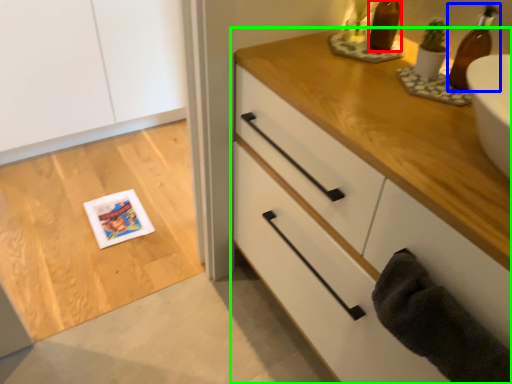
Question: Which object is positioned closest to bottle (highlighted by a red box)? Select from beer bottle (highlighted by a blue box) and chest of drawers (highlighted by a green box).

Choices:
 (A) beer bottle
 (B) chest of drawers

Answer: (A)